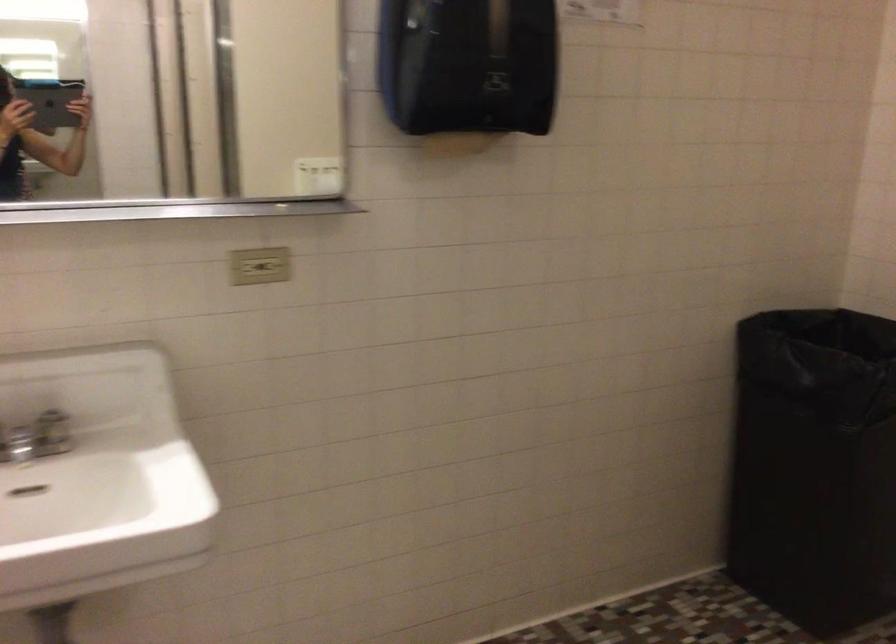
Identify the location of paper towel dispenser. The image size is (896, 644). (468, 64).